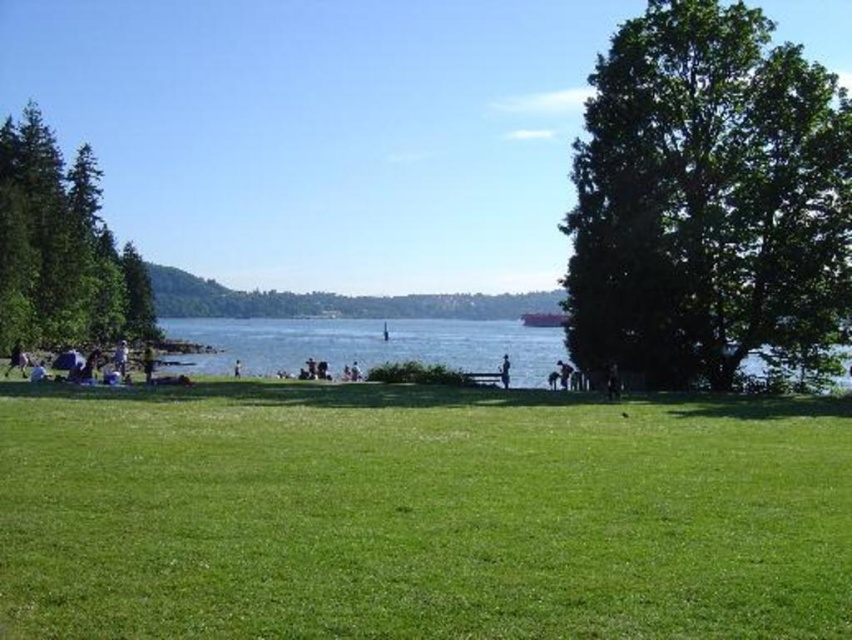
Who is lower down, green grassy field at center or green leafy tree at right?

Positioned lower is green grassy field at center.

Between green grassy field at center and green leafy tree at right, which one appears on the right side from the viewer's perspective?

Positioned to the right is green leafy tree at right.

Measure the distance between point (327, 582) and camera.

A distance of 9.46 meters exists between point (327, 582) and camera.

At what (x,y) coordinates should I click in order to perform the action: click on green grassy field at center. Please return your answer as a coordinate pair (x, y). Looking at the image, I should click on (419, 515).

Identify the location of yellow fabric person at lower left. The width and height of the screenshot is (852, 640). (147, 362).

Does point (147, 355) come closer to viewer compared to point (557, 372)?

No, (147, 355) is further to viewer.

Does point (142, 365) come in front of point (557, 376)?

No.

The image size is (852, 640). In order to click on yellow fabric person at lower left in this screenshot , I will do `click(147, 362)`.

Between point (689, 337) and point (204, 323), which one is positioned in front?

Point (689, 337)

Measure the distance between green leafy tree at right and camera.

green leafy tree at right and camera are 37.35 meters apart.

What do you see at coordinates (707, 196) in the screenshot? I see `green leafy tree at right` at bounding box center [707, 196].

This screenshot has height=640, width=852. Identify the location of green leafy tree at right. (707, 196).